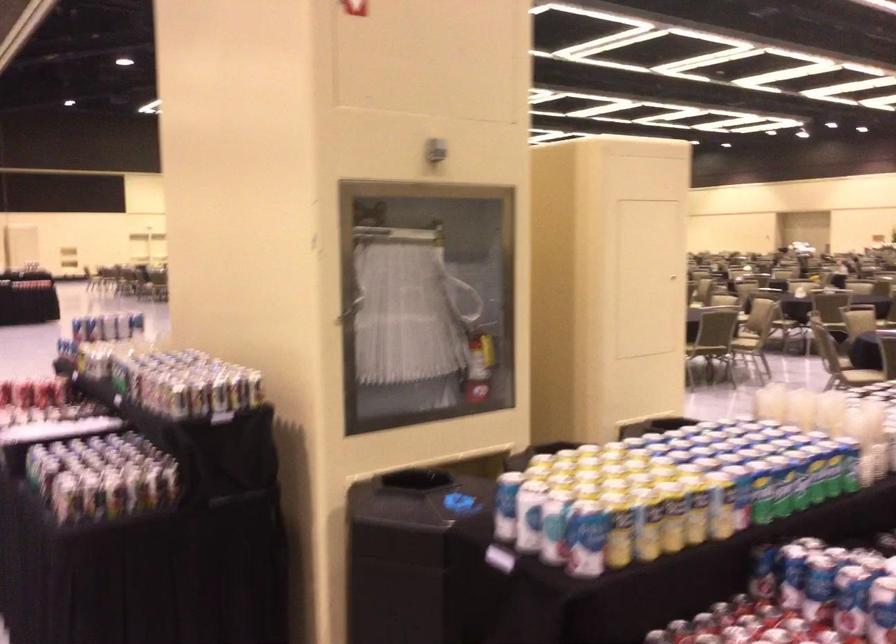
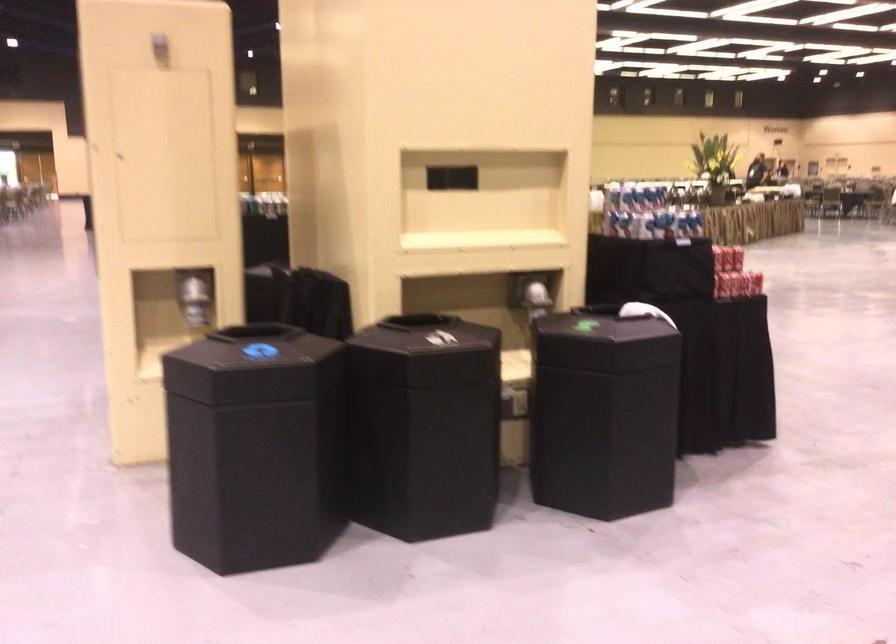
Question: I am providing you with two images of the same scene from different viewpoints. Which of the following objects are not visible in image2?

Choices:
 (A) shiny dispenser lever
 (B) black round speaker
 (C) black bin lid
 (D) cabinet door handle

Answer: (D)